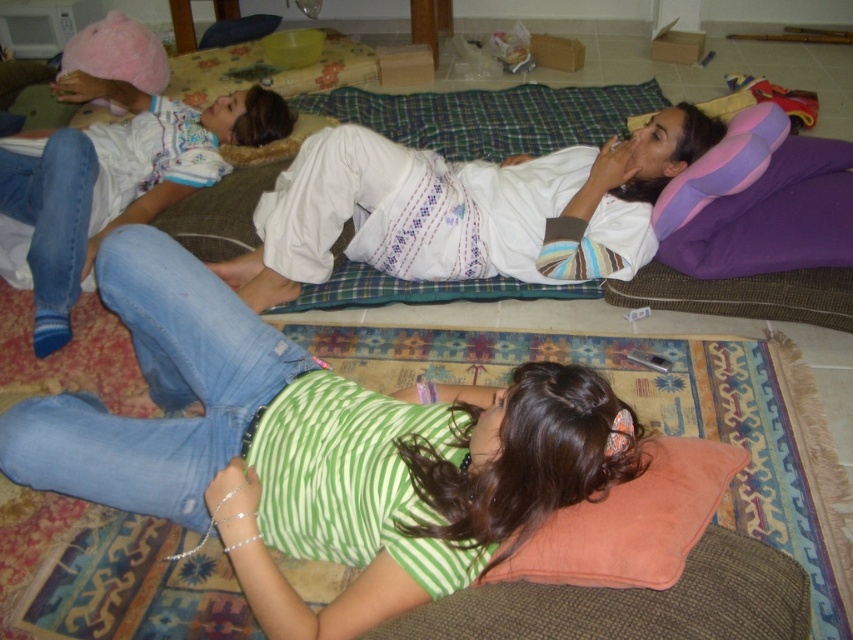
Question: Which object is farther from the camera taking this photo?

Choices:
 (A) pink fuzzy hat at upper left
 (B) white cotton shirt at center

Answer: (A)

Question: Is green striped shirt at lower center positioned behind white cotton shirt at center?

Choices:
 (A) no
 (B) yes

Answer: (A)

Question: Which point appears closest to the camera in this image?

Choices:
 (A) (424, 214)
 (B) (606, 532)
 (C) (267, 108)
 (D) (663, 205)

Answer: (B)

Question: Which point appears closest to the camera in this image?

Choices:
 (A) (227, 140)
 (B) (749, 161)

Answer: (B)

Question: Is white cotton shirt at center further to the viewer compared to pink fuzzy hat at upper left?

Choices:
 (A) yes
 (B) no

Answer: (B)

Question: Observing the image, what is the correct spatial positioning of pink fuzzy hat at upper left in reference to purple/pink foam pillow at upper right?

Choices:
 (A) left
 (B) right

Answer: (A)